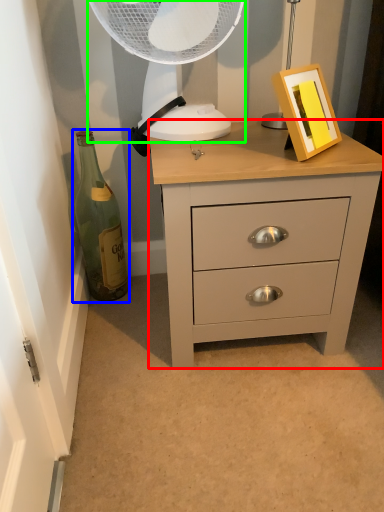
Question: Which is farther away from chest of drawers (highlighted by a red box)? bottle (highlighted by a blue box) or mechanical fan (highlighted by a green box)?

Choices:
 (A) bottle
 (B) mechanical fan

Answer: (A)